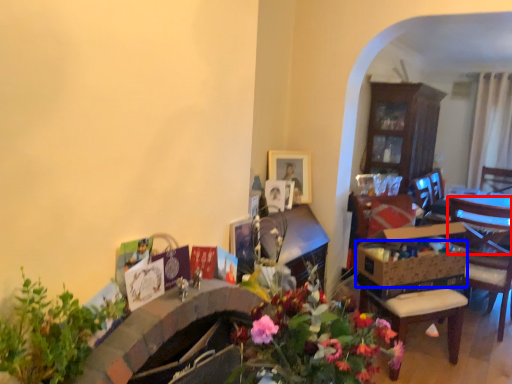
Question: Which point is further to the camera, chair (highlighted by a red box) or flower basket (highlighted by a blue box)?

Choices:
 (A) chair
 (B) flower basket

Answer: (A)